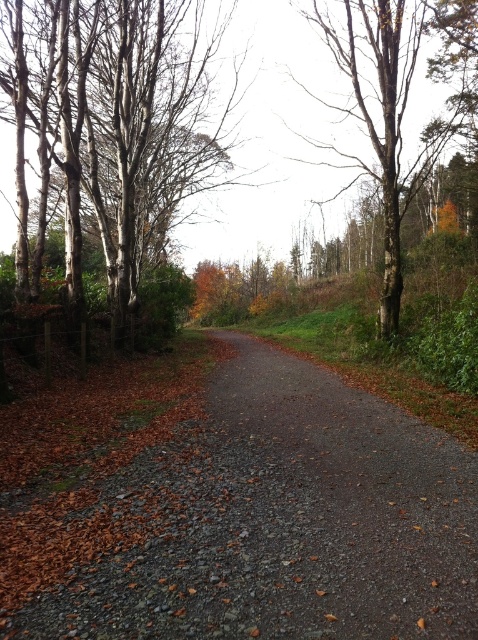
Does brown gravel trail at center have a lesser width compared to bare bark tree at upper right?

Yes, brown gravel trail at center is thinner than bare bark tree at upper right.

Does brown gravel trail at center have a larger size compared to bare bark tree at upper right?

No.

Which is behind, point (343, 426) or point (397, 157)?

Point (397, 157)

Find the location of `brown gravel trail at center`. brown gravel trail at center is located at coordinates (282, 522).

Consider the image. Which is above, smooth white bark at left or bare bark tree at upper right?

Answer: bare bark tree at upper right is above.

Looking at this image, measure the distance between point (x=65, y=8) and camera.

Point (x=65, y=8) and camera are 40.38 feet apart from each other.

Locate an element on the screen. Image resolution: width=478 pixels, height=640 pixels. smooth white bark at left is located at coordinates (115, 122).

Which of these two, brown gravel trail at center or smooth white bark at left, stands taller?

smooth white bark at left is taller.

Is point (265, 586) less distant than point (219, 177)?

Yes, point (265, 586) is in front of point (219, 177).

This screenshot has height=640, width=478. What do you see at coordinates (282, 522) in the screenshot?
I see `brown gravel trail at center` at bounding box center [282, 522].

Identify the location of brown gravel trail at center. This screenshot has height=640, width=478. (282, 522).